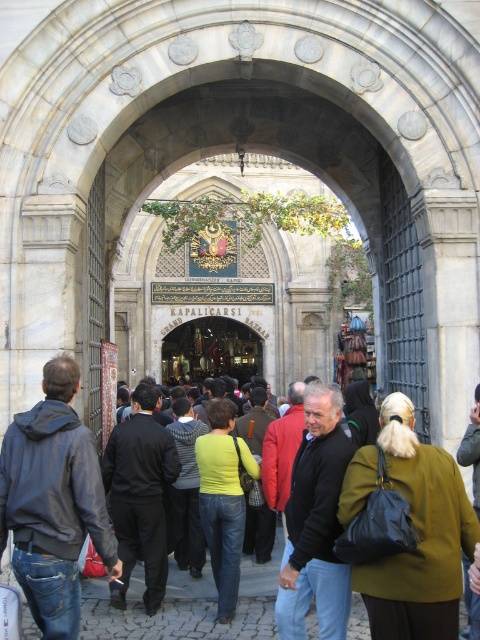
You are a photographer standing at the entrance of Kapalicarsi Bazaar. You want to take a clear photo of the black matte jacket at center without the green fabric crowd at center blocking it. What should you do?

The black matte jacket at center has a lesser height compared to green fabric crowd at center, so you can kneel down to lower your camera angle to capture the black matte jacket at center without the green fabric crowd at center blocking it.

You are a photographer standing at the entrance of Kapalicarsi Bazaar. You want to capture a photo of the black matte jacket at center and the green fabric crowd at center. Which object should you focus on first if you want to ensure both are in sharp focus?

The black matte jacket at center is located above the green fabric crowd at center, so you should focus on the black matte jacket at center first to ensure both are in sharp focus.

You are a delivery person carrying a package that requires a clear path of at least 10 meters between two jackets to pass through. Can you safely navigate between the denim jacket at center and the black matte jacket at center?

The distance between the denim jacket at center and the black matte jacket at center is 11.41 meters, which is more than the required 10 meters. Therefore, you can safely navigate between them with the package.